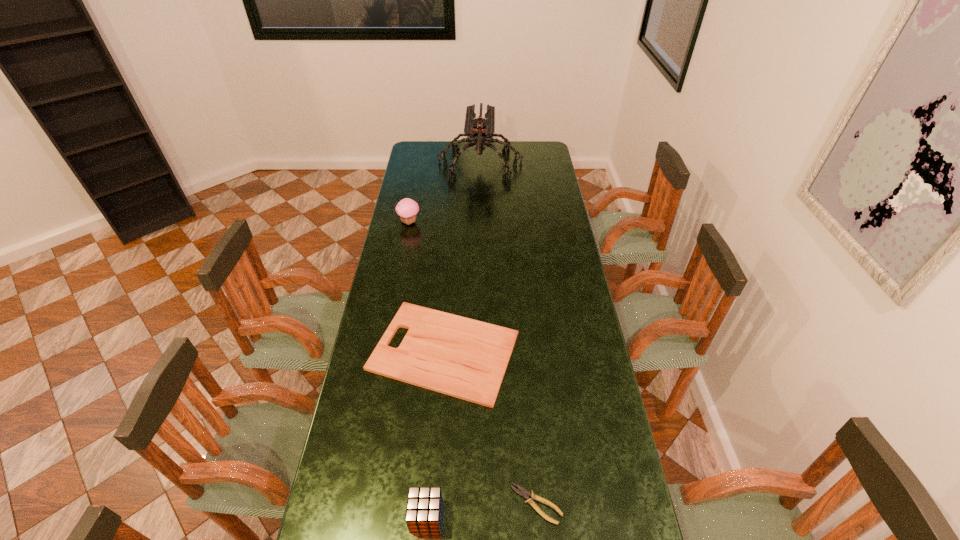
Locate an element on the screen. vacant region located on the back of the third shortest object is located at coordinates (431, 458).

Find the location of `free spot located on the back of the chopping board`. free spot located on the back of the chopping board is located at coordinates (448, 291).

Where is `blank space located 0.270m on the back of the shortest object`? The image size is (960, 540). blank space located 0.270m on the back of the shortest object is located at coordinates (527, 395).

Identify the location of object located at the far edge. (480, 131).

This screenshot has width=960, height=540. Identify the location of cupcake present at the left edge. (407, 209).

The width and height of the screenshot is (960, 540). I want to click on chopping board that is at the left edge, so click(461, 357).

Find the location of `free space at the far edge of the desktop`. free space at the far edge of the desktop is located at coordinates [510, 153].

The image size is (960, 540). What are the coordinates of `free space at the left edge of the desktop` in the screenshot? It's located at (415, 165).

Where is `vacant space at the right edge`? The height and width of the screenshot is (540, 960). vacant space at the right edge is located at coordinates (550, 339).

Locate an element on the screen. The height and width of the screenshot is (540, 960). blank space at the far left corner of the desktop is located at coordinates (416, 157).